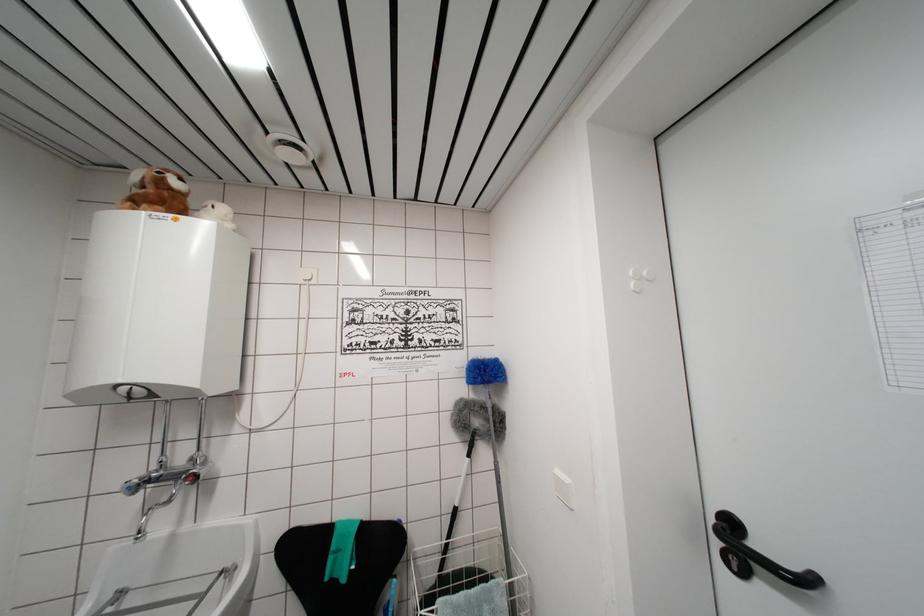
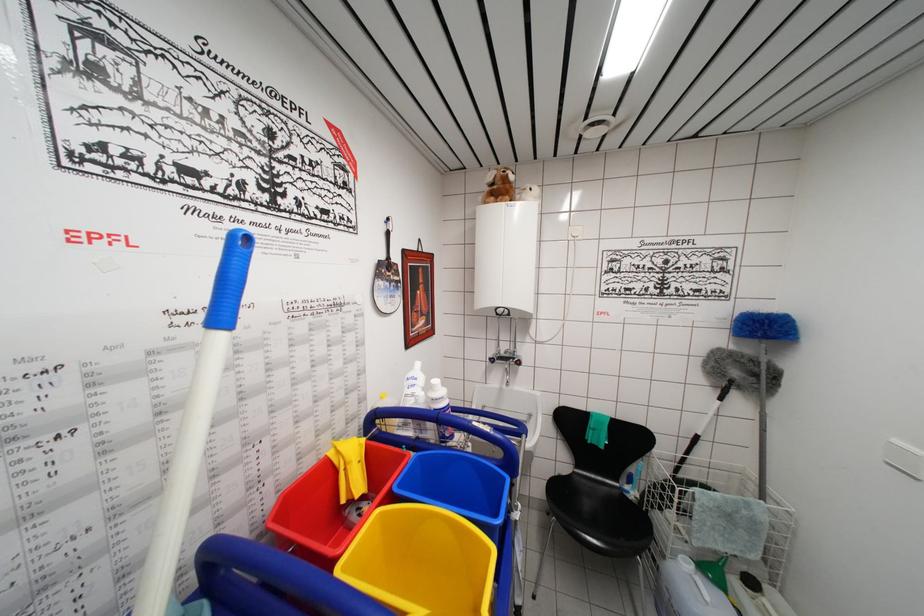
Question: The camera is either moving clockwise (left) or counter-clockwise (right) around the object. The first image is from the beginning of the video and the second image is from the end. Is the camera moving left or right when shooting the video?

Choices:
 (A) Left
 (B) Right

Answer: (B)